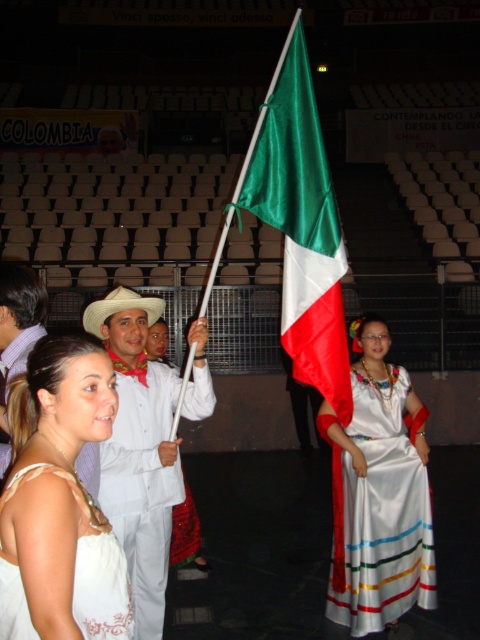
Does white satin dress at center appear over matte white suit at center?

Incorrect, white satin dress at center is not positioned above matte white suit at center.

Is point (363, 614) positioned before point (288, 358)?

Yes.

Does point (409, 528) come closer to viewer compared to point (299, 426)?

Yes, it is.

The width and height of the screenshot is (480, 640). Identify the location of white satin dress at center. (379, 509).

Between shiny satin flag at center and white felt cowboy hat at center, which one appears on the right side from the viewer's perspective?

shiny satin flag at center

Where is `shiny satin flag at center`? This screenshot has height=640, width=480. shiny satin flag at center is located at coordinates (301, 225).

What do you see at coordinates (301, 225) in the screenshot? Image resolution: width=480 pixels, height=640 pixels. I see `shiny satin flag at center` at bounding box center [301, 225].

The height and width of the screenshot is (640, 480). Find the location of `shiny satin flag at center`. shiny satin flag at center is located at coordinates (301, 225).

Between white satin dress at center and white felt cowboy hat at center, which one has less height?

white felt cowboy hat at center

Can you confirm if white satin dress at center is bigger than white felt cowboy hat at center?

Indeed, white satin dress at center has a larger size compared to white felt cowboy hat at center.

What do you see at coordinates (379, 509) in the screenshot? Image resolution: width=480 pixels, height=640 pixels. I see `white satin dress at center` at bounding box center [379, 509].

The image size is (480, 640). In order to click on white satin dress at center in this screenshot , I will do `click(379, 509)`.